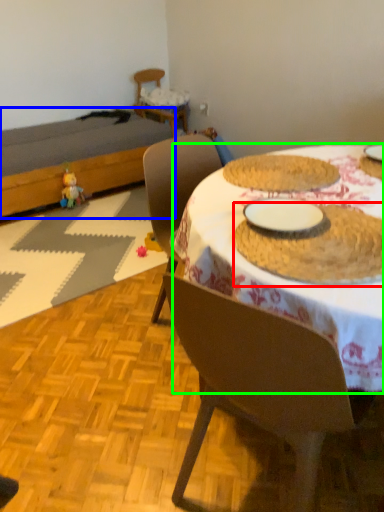
Question: Considering the real-world distances, which object is farthest from food (highlighted by a red box)? bed (highlighted by a blue box) or desk (highlighted by a green box)?

Choices:
 (A) bed
 (B) desk

Answer: (A)